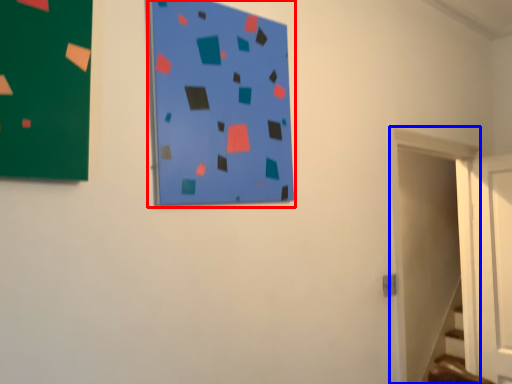
Question: Which object is closer to the camera taking this photo, bulletin board (highlighted by a red box) or door (highlighted by a blue box)?

Choices:
 (A) bulletin board
 (B) door

Answer: (A)